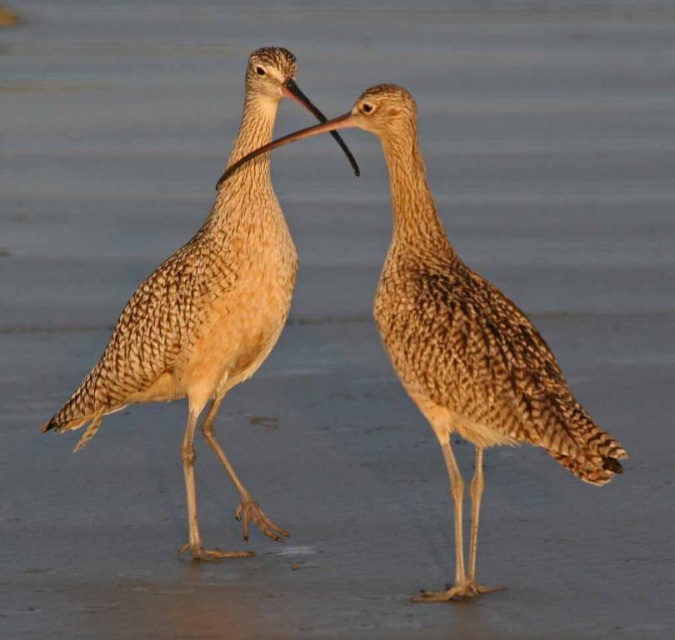
Question: Does brown speckled feathers at center have a lesser width compared to speckled feathered shorebird at center?

Choices:
 (A) no
 (B) yes

Answer: (A)

Question: Which point appears closest to the camera in this image?

Choices:
 (A) (188, 365)
 (B) (487, 356)

Answer: (B)

Question: Which point is closer to the camera?

Choices:
 (A) brown speckled feathers at center
 (B) speckled feathered shorebird at center

Answer: (A)

Question: Does brown speckled feathers at center lie in front of speckled feathered shorebird at center?

Choices:
 (A) no
 (B) yes

Answer: (B)

Question: Considering the relative positions of brown speckled feathers at center and speckled feathered shorebird at center in the image provided, where is brown speckled feathers at center located with respect to speckled feathered shorebird at center?

Choices:
 (A) left
 (B) right

Answer: (B)